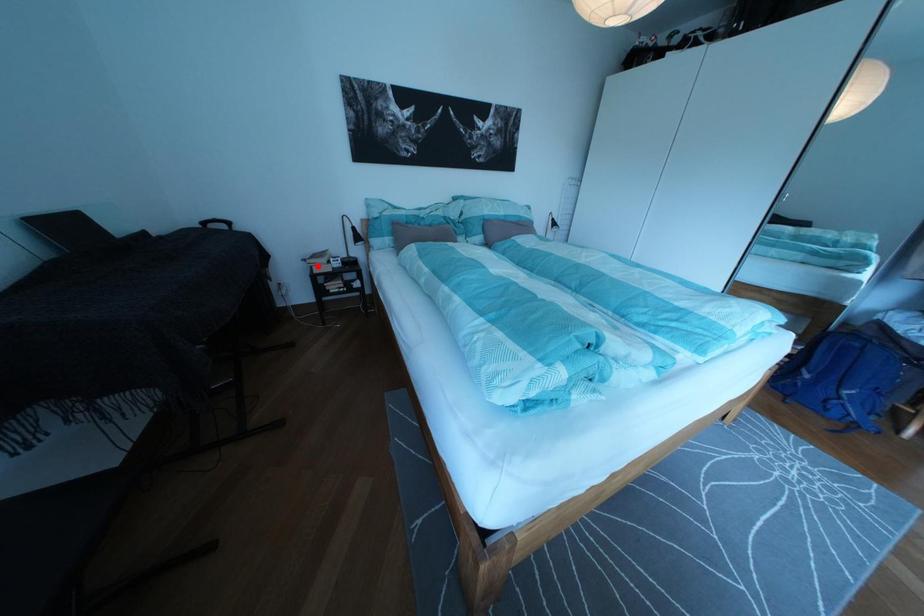
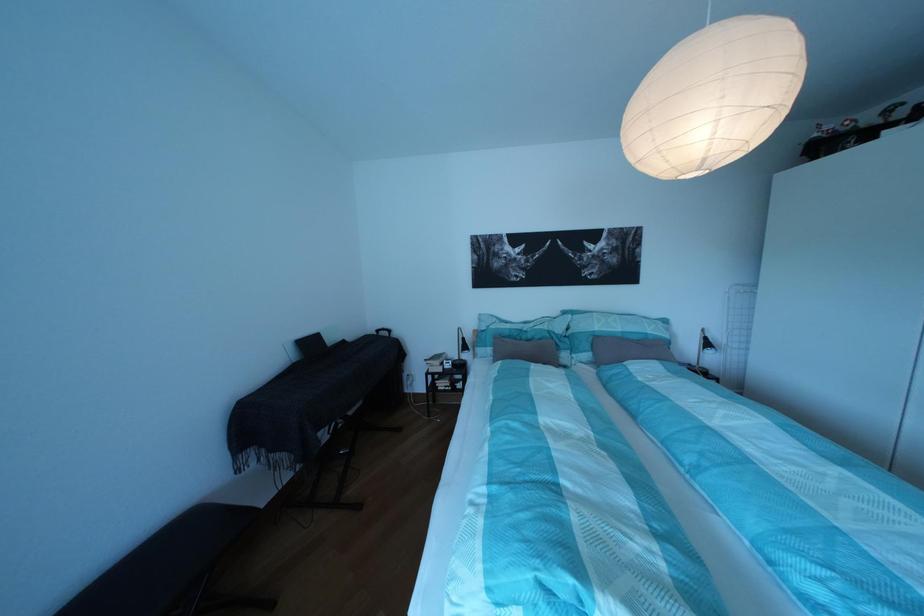
Question: I am providing you with two images of the same scene from different viewpoints. Image1 has a red point marked. In image2, the corresponding 3D location appears at what relative position? Reply with the corresponding letter.

Choices:
 (A) Closer
 (B) Farther

Answer: (B)